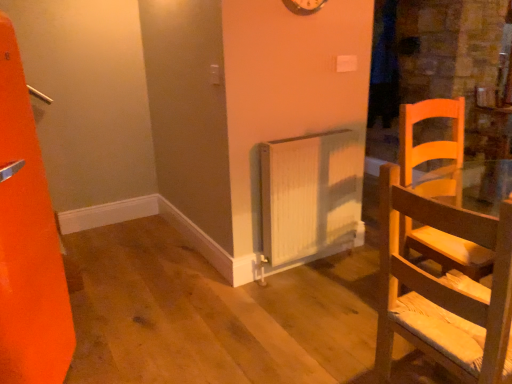
In order to face white ribbed radiator at center, should I rotate leftwards or rightwards?

It's best to rotate right around 7.659 degrees.

The height and width of the screenshot is (384, 512). I want to click on white ribbed radiator at center, so click(308, 197).

The height and width of the screenshot is (384, 512). What do you see at coordinates (444, 290) in the screenshot?
I see `light wood chair at right` at bounding box center [444, 290].

In order to click on metallic silver clock at upper center in this screenshot , I will do `click(304, 6)`.

Locate an element on the screen. The width and height of the screenshot is (512, 384). white ribbed radiator at center is located at coordinates (308, 197).

Which object is closer to the camera taking this photo, light wood chair at right or metallic silver clock at upper center?

light wood chair at right is closer to the camera.

Looking at this image, can you confirm if light wood chair at right is smaller than metallic silver clock at upper center?

Actually, light wood chair at right might be larger than metallic silver clock at upper center.

The width and height of the screenshot is (512, 384). I want to click on clock on the left of light wood chair at right, so click(x=304, y=6).

Are metallic silver clock at upper center and light wood chair at right making contact?

No.

Measure the distance from metallic silver clock at upper center to light wood chair at right.

A distance of 1.47 meters exists between metallic silver clock at upper center and light wood chair at right.

In the image, there is a metallic silver clock at upper center. Where is `chair below it (from a real-world perspective)`? The image size is (512, 384). chair below it (from a real-world perspective) is located at coordinates (444, 290).

Could you tell me if metallic silver clock at upper center is turned towards light wood chair at right?

No.

Can you confirm if metallic silver clock at upper center is bigger than white ribbed radiator at center?

Actually, metallic silver clock at upper center might be smaller than white ribbed radiator at center.

Is white ribbed radiator at center completely or partially inside metallic silver clock at upper center?

No, metallic silver clock at upper center does not contain white ribbed radiator at center.

From the image's perspective, does metallic silver clock at upper center appear lower than white ribbed radiator at center?

No, from the image's perspective, metallic silver clock at upper center is not beneath white ribbed radiator at center.

Does metallic silver clock at upper center have a lesser height compared to white ribbed radiator at center?

Correct, metallic silver clock at upper center is not as tall as white ribbed radiator at center.

Is white ribbed radiator at center positioned beyond the bounds of light wood chair at right?

Yes, white ribbed radiator at center is not within light wood chair at right.

Considering the positions of objects white ribbed radiator at center and light wood chair at right in the image provided, who is more to the left, white ribbed radiator at center or light wood chair at right?

From the viewer's perspective, white ribbed radiator at center appears more on the left side.

Does white ribbed radiator at center lie behind light wood chair at right?

Yes, white ribbed radiator at center is further from the viewer.

Who is shorter, white ribbed radiator at center or light wood chair at right?

white ribbed radiator at center.

Locate an element on the screen. This screenshot has width=512, height=384. chair lying in front of the white ribbed radiator at center is located at coordinates (444, 290).

Is light wood chair at right not inside white ribbed radiator at center?

Yes.

Considering the relative sizes of light wood chair at right and white ribbed radiator at center in the image provided, is light wood chair at right thinner than white ribbed radiator at center?

Incorrect, the width of light wood chair at right is not less than that of white ribbed radiator at center.

Is white ribbed radiator at center facing away from metallic silver clock at upper center?

white ribbed radiator at center does not have its back to metallic silver clock at upper center.

Is white ribbed radiator at center located outside metallic silver clock at upper center?

Yes, white ribbed radiator at center is outside of metallic silver clock at upper center.

Which of these two, white ribbed radiator at center or metallic silver clock at upper center, is smaller?

Smaller between the two is metallic silver clock at upper center.

Locate an element on the screen. Image resolution: width=512 pixels, height=384 pixels. chair in front of the metallic silver clock at upper center is located at coordinates (444, 290).

Where is `clock lying on the left of light wood chair at right`? clock lying on the left of light wood chair at right is located at coordinates (304, 6).

Estimate the real-world distances between objects in this image. Which object is further from white ribbed radiator at center, light wood chair at right or metallic silver clock at upper center?

light wood chair at right lies further to white ribbed radiator at center than the other object.

Considering their positions, is metallic silver clock at upper center positioned further to light wood chair at right than white ribbed radiator at center?

metallic silver clock at upper center is positioned further to the anchor light wood chair at right.

In the scene shown: Considering their positions, is metallic silver clock at upper center positioned further to white ribbed radiator at center than light wood chair at right?

The object further to white ribbed radiator at center is light wood chair at right.

Based on their spatial positions, is white ribbed radiator at center or light wood chair at right further from metallic silver clock at upper center?

light wood chair at right.

From the image, which object appears to be nearer to light wood chair at right, white ribbed radiator at center or metallic silver clock at upper center?

The object closer to light wood chair at right is white ribbed radiator at center.

Looking at the image, which one is located closer to metallic silver clock at upper center, light wood chair at right or white ribbed radiator at center?

white ribbed radiator at center is closer to metallic silver clock at upper center.

This screenshot has width=512, height=384. Find the location of `radiator between metallic silver clock at upper center and light wood chair at right in the vertical direction`. radiator between metallic silver clock at upper center and light wood chair at right in the vertical direction is located at coordinates (308, 197).